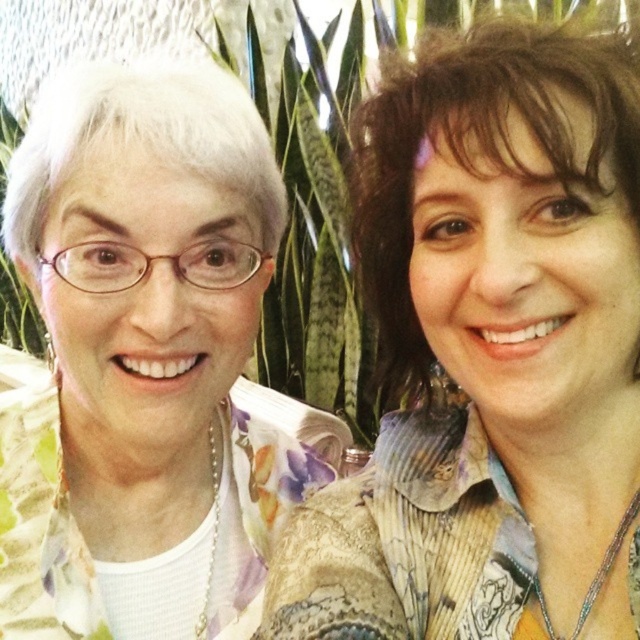
Question: Which of the following is the farthest from the observer?

Choices:
 (A) tap(396, 493)
 (B) tap(84, 506)

Answer: (B)

Question: Does floral fabric blouse at left appear on the left side of white floral shirt at left?

Choices:
 (A) no
 (B) yes

Answer: (A)

Question: Can you confirm if floral fabric blouse at left is positioned above white floral shirt at left?

Choices:
 (A) no
 (B) yes

Answer: (A)

Question: Which of the following is the closest to the observer?

Choices:
 (A) (428, 140)
 (B) (240, 481)

Answer: (A)

Question: Where is floral fabric blouse at left located in relation to white floral shirt at left in the image?

Choices:
 (A) left
 (B) right

Answer: (B)

Question: Among these points, which one is nearest to the camera?

Choices:
 (A) (573, 573)
 (B) (208, 132)

Answer: (A)